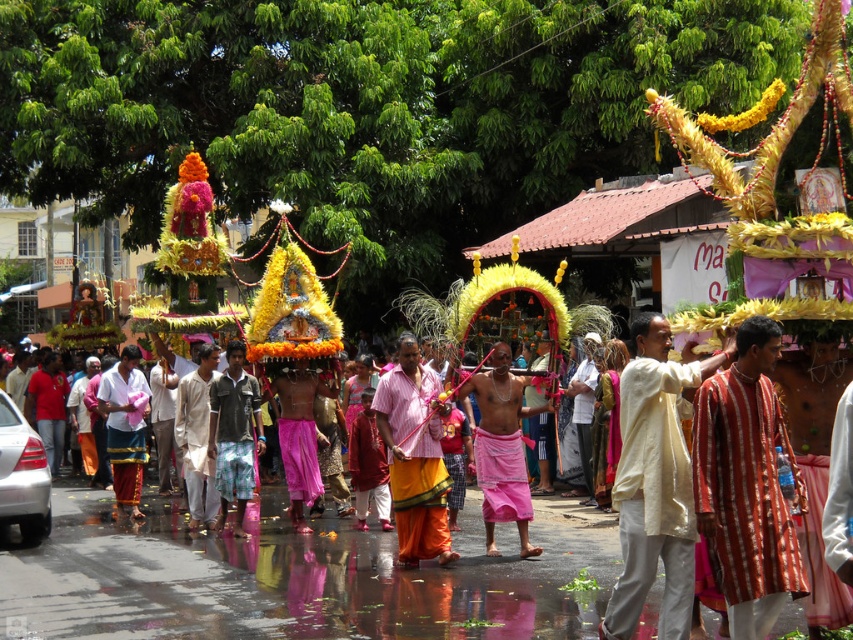
Between striped cotton kurta at center and yellow cotton saree at center, which one has less height?

striped cotton kurta at center is shorter.

Is point (720, 522) farther from camera compared to point (376, 394)?

No, (720, 522) is closer to viewer.

Between point (755, 380) and point (434, 406), which one is positioned in front?

Point (755, 380) is in front.

At what (x,y) coordinates should I click in order to perform the action: click on striped cotton kurta at center. Please return your answer as a coordinate pair (x, y). The width and height of the screenshot is (853, 640). Looking at the image, I should click on (747, 483).

Is pink cotton cloth at center smaller than light beige cotton kurta at center?

No, pink cotton cloth at center is not smaller than light beige cotton kurta at center.

Which is below, pink cotton cloth at center or light beige cotton kurta at center?

Positioned lower is light beige cotton kurta at center.

Is point (521, 465) more distant than point (198, 474)?

No, it is not.

This screenshot has width=853, height=640. I want to click on pink cotton cloth at center, so click(x=502, y=448).

Which of these two, striped cotton kurta at center or white cotton kurta at center, stands shorter?

striped cotton kurta at center

Can you confirm if striped cotton kurta at center is shorter than white cotton kurta at center?

Indeed, striped cotton kurta at center has a lesser height compared to white cotton kurta at center.

What do you see at coordinates (747, 483) in the screenshot? I see `striped cotton kurta at center` at bounding box center [747, 483].

This screenshot has height=640, width=853. Identify the location of striped cotton kurta at center. (747, 483).